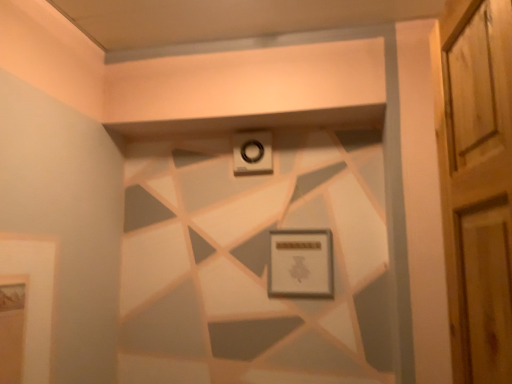
Question: Is white plastic alarm at upper center taller or shorter than matte white picture frame at center?

Choices:
 (A) tall
 (B) short

Answer: (B)

Question: Does point (240, 147) appear closer or farther from the camera than point (328, 281)?

Choices:
 (A) farther
 (B) closer

Answer: (A)

Question: From a real-world perspective, is white plastic alarm at upper center positioned above or below matte white picture frame at center?

Choices:
 (A) above
 (B) below

Answer: (A)

Question: In the image, is matte white picture frame at center on the left side or the right side of white plastic alarm at upper center?

Choices:
 (A) right
 (B) left

Answer: (A)

Question: Is point (289, 291) positioned closer to the camera than point (232, 139)?

Choices:
 (A) closer
 (B) farther

Answer: (A)

Question: From the image's perspective, relative to white plastic alarm at upper center, is matte white picture frame at center above or below?

Choices:
 (A) below
 (B) above

Answer: (A)

Question: Based on their sizes in the image, would you say matte white picture frame at center is bigger or smaller than white plastic alarm at upper center?

Choices:
 (A) big
 (B) small

Answer: (A)